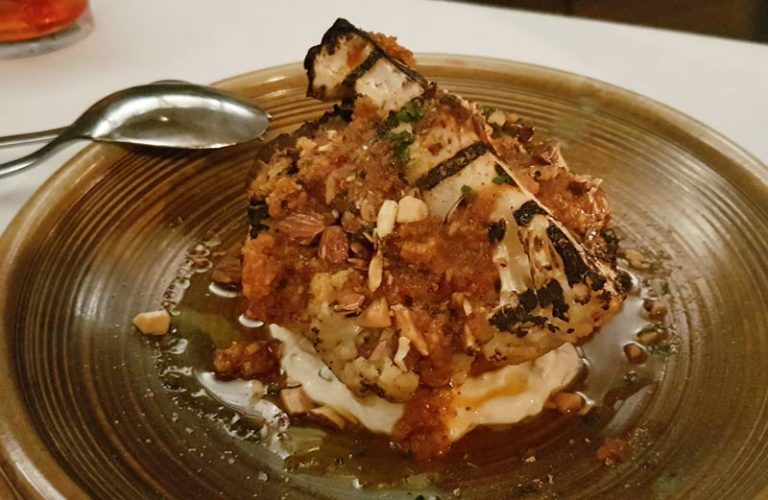
Identify the location of handle of a utensil. The image size is (768, 500). (17, 138).